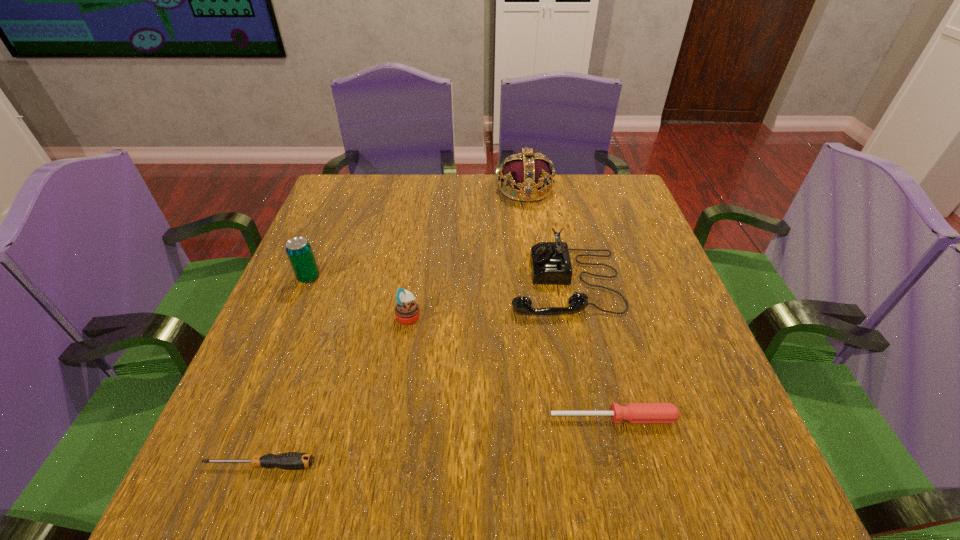
The width and height of the screenshot is (960, 540). What are the coordinates of `the farthest object` in the screenshot? It's located at (524, 172).

I want to click on crown, so click(x=524, y=172).

Image resolution: width=960 pixels, height=540 pixels. I want to click on beer can, so click(x=298, y=249).

Identify the location of telephone. This screenshot has height=540, width=960. (550, 261).

Find the location of `the third shortest object`. the third shortest object is located at coordinates (407, 312).

Image resolution: width=960 pixels, height=540 pixels. In order to click on the fourth object from right to left in this screenshot , I will do `click(407, 312)`.

At what (x,y) coordinates should I click in order to perform the action: click on the right screwdriver. Please return your answer as a coordinate pair (x, y). This screenshot has height=540, width=960. Looking at the image, I should click on (633, 412).

In order to click on the farther screwdriver in this screenshot , I will do `click(633, 412)`.

Image resolution: width=960 pixels, height=540 pixels. In order to click on the nearest object in this screenshot , I will do `click(291, 460)`.

Locate an element on the screen. Image resolution: width=960 pixels, height=540 pixels. the nearer screwdriver is located at coordinates (291, 460).